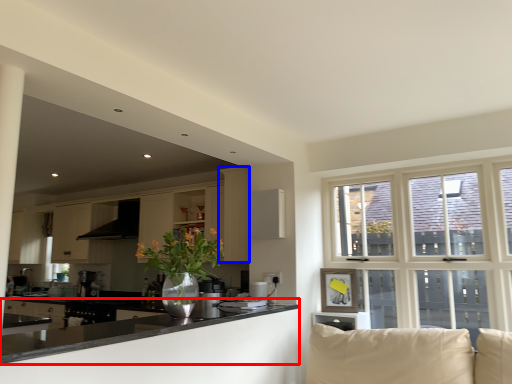
Question: Which point is closer to the camera, countertop (highlighted by a red box) or cabinetry (highlighted by a blue box)?

Choices:
 (A) countertop
 (B) cabinetry

Answer: (A)